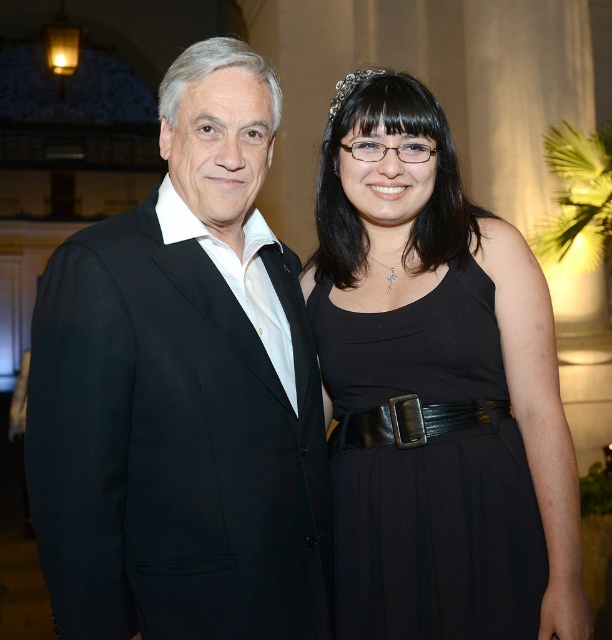
Who is taller, black matte suit at left or black leather dress at center?

black matte suit at left is taller.

Measure the distance between black matte suit at left and camera.

black matte suit at left is 8.40 meters away from camera.

Does point (209, 115) lie in front of point (442, 397)?

Yes, point (209, 115) is closer to viewer.

The height and width of the screenshot is (640, 612). Find the location of `black matte suit at left`. black matte suit at left is located at coordinates (184, 392).

Is black matte suit at left closer to camera compared to black leather belt at center?

Yes, black matte suit at left is in front of black leather belt at center.

The image size is (612, 640). What do you see at coordinates (184, 392) in the screenshot?
I see `black matte suit at left` at bounding box center [184, 392].

This screenshot has height=640, width=612. Identify the location of black matte suit at left. (x=184, y=392).

Is black leather dress at center wider than silver metallic tiara at upper center?

Correct, the width of black leather dress at center exceeds that of silver metallic tiara at upper center.

Describe the element at coordinates (428, 467) in the screenshot. The height and width of the screenshot is (640, 612). I see `black leather dress at center` at that location.

Which is in front, point (442, 513) or point (337, 97)?

Positioned in front is point (442, 513).

The width and height of the screenshot is (612, 640). Find the location of `black leather dress at center`. black leather dress at center is located at coordinates (428, 467).